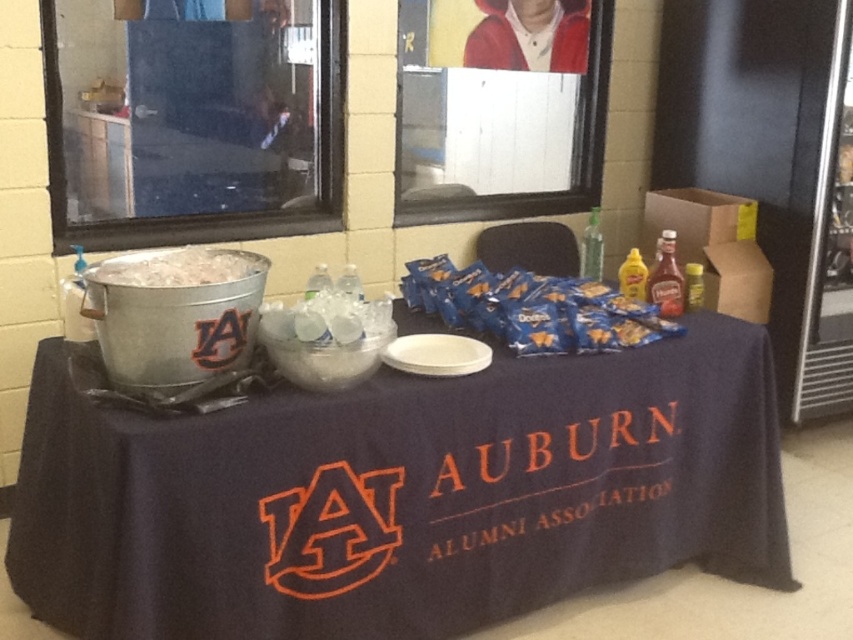
You are organizing a party and need to place a small decorative item on the table. The item requires a stable, flat surface. Which object between the blue matte doritos at center and the white frosted ice at left would be more suitable for placing the item?

The blue matte doritos at center is much taller than the white frosted ice at left, so the blue matte doritos at center would provide a more stable and flat surface for placing the decorative item.